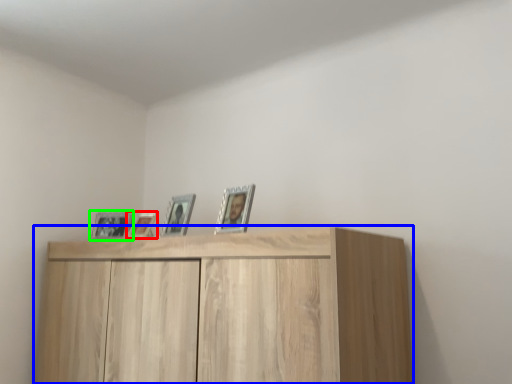
Question: Which object is positioned closest to picture frame (highlighted by a red box)? Select from cupboard (highlighted by a blue box) and picture frame (highlighted by a green box).

Choices:
 (A) cupboard
 (B) picture frame

Answer: (B)